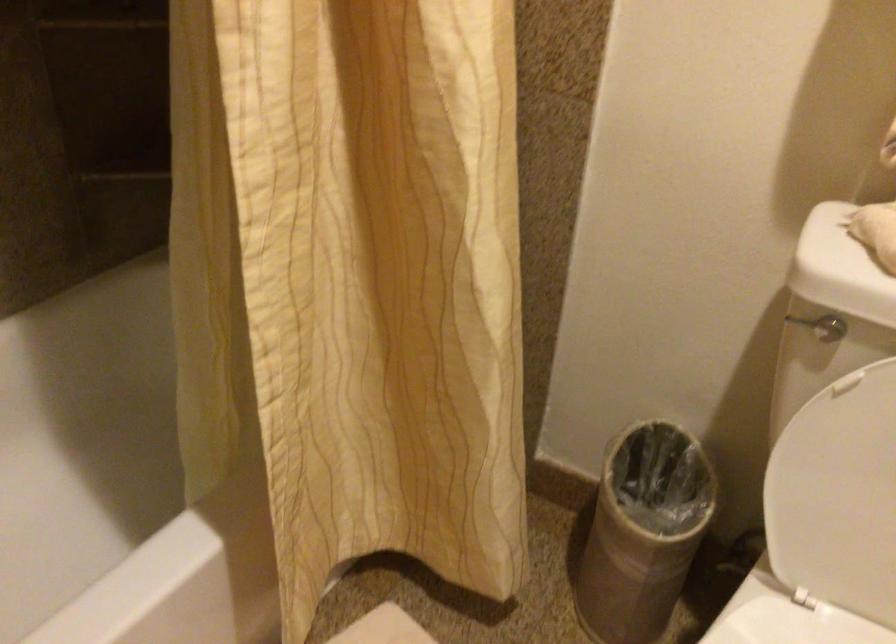
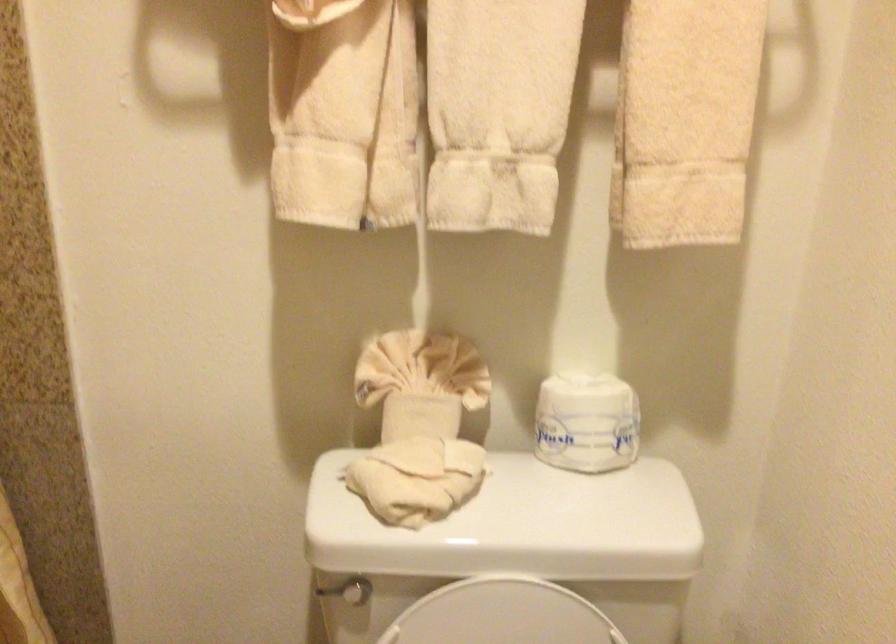
Where in the second image is the point corresponding to pixel 793 315 from the first image?

(326, 590)